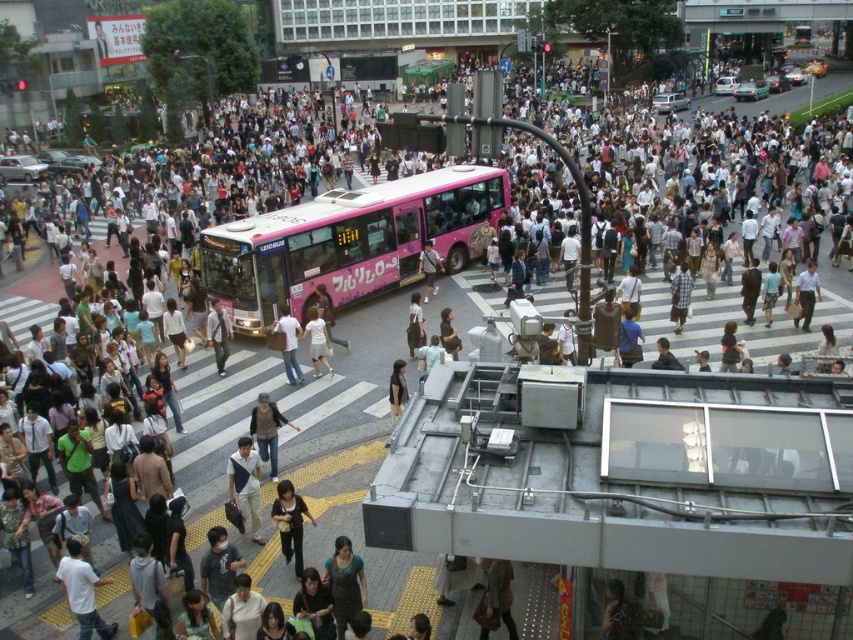
Between denim overalls at center and white cotton shirt at center, which one has more height?

white cotton shirt at center is taller.

The height and width of the screenshot is (640, 853). What do you see at coordinates (345, 582) in the screenshot?
I see `denim overalls at center` at bounding box center [345, 582].

Where is `denim overalls at center`? The width and height of the screenshot is (853, 640). denim overalls at center is located at coordinates (345, 582).

Between denim overalls at center and white cotton dress at center, which one appears on the left side from the viewer's perspective?

From the viewer's perspective, white cotton dress at center appears more on the left side.

Is denim overalls at center taller than white cotton dress at center?

In fact, denim overalls at center may be shorter than white cotton dress at center.

This screenshot has height=640, width=853. I want to click on denim overalls at center, so click(345, 582).

Find the location of `denim overalls at center`. denim overalls at center is located at coordinates (345, 582).

Is denim overalls at center positioned before light blue shirt at center?

Yes.

The height and width of the screenshot is (640, 853). I want to click on denim overalls at center, so click(x=345, y=582).

Where is `denim overalls at center`? denim overalls at center is located at coordinates (345, 582).